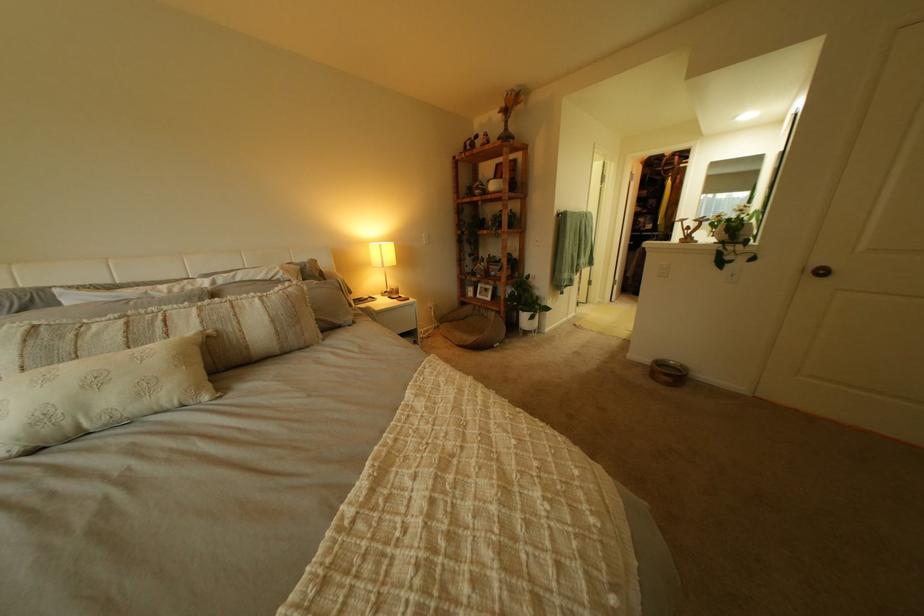
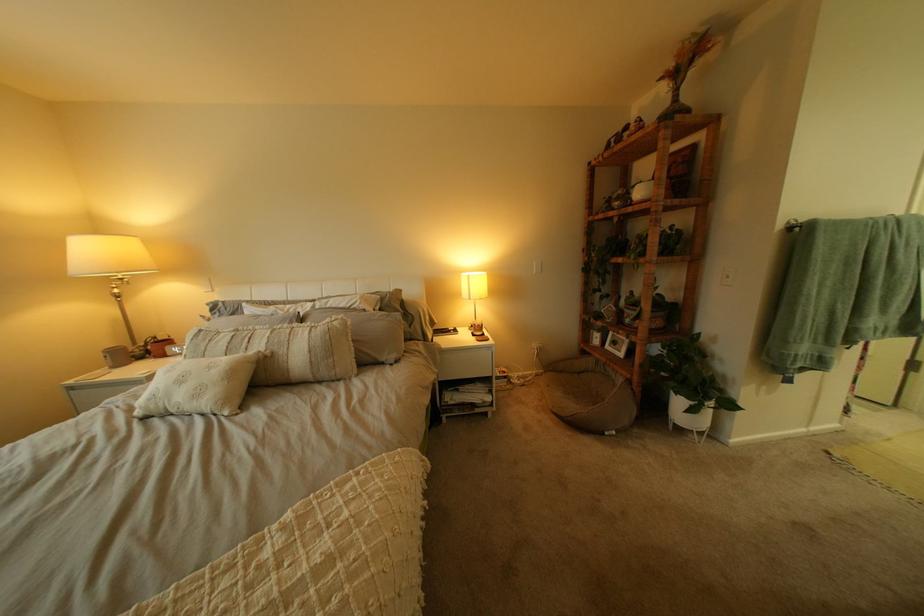
Where in the second image is the point corresponding to point (515, 113) from the first image?

(675, 81)